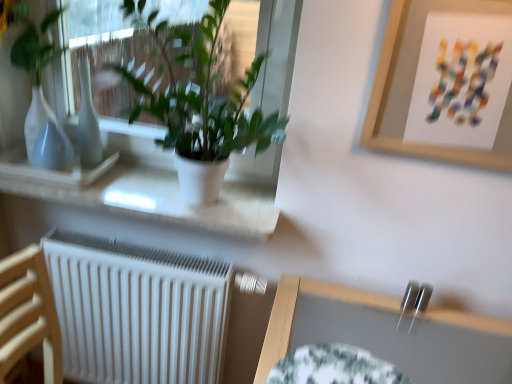
Identify the location of vacant area that is situated to the right of white glossy vase at upper left, the second vase in the left-to-right sequence. This screenshot has height=384, width=512. (132, 175).